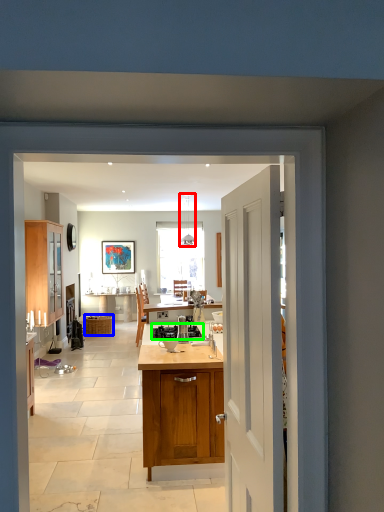
Question: Considering the real-world distances, which object is closest to lamp (highlighted by a red box)? picnic basket (highlighted by a blue box) or gas stove (highlighted by a green box).

Choices:
 (A) picnic basket
 (B) gas stove

Answer: (A)